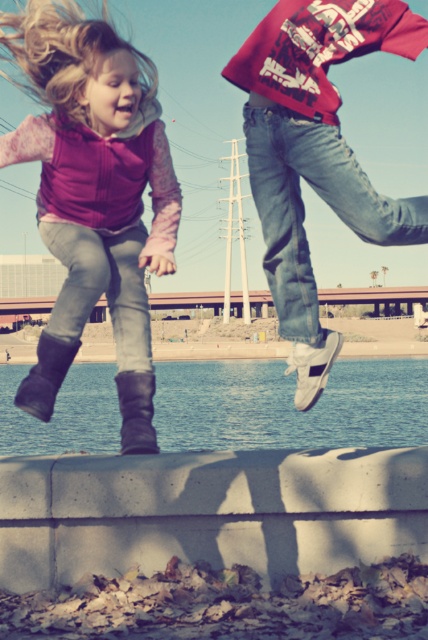
You are standing at the point labeled point (91, 67) and want to take a photo of the two children jumping off the concrete barrier. The camera you have can focus on subjects within 15 feet. Will the camera be able to capture the children clearly?

The point labeled point (91, 67) and the camera are 14.88 feet apart from each other, which is within the 15 feet focus range. Therefore, the camera will be able to capture the children clearly.

What is the purpose of the point at coordinates (94, 195) in the image?

The point at coordinates (94, 195) is located on the matte pink vest at upper left.

You are a photographer trying to capture both the matte pink vest at upper left and the blue water at lower center in the same frame. Based on their sizes, which object should you focus on first to ensure both are fully visible in the photo?

The matte pink vest at upper left has a smaller width compared to the blue water at lower center. To ensure both are fully visible, focus on the larger blue water at lower center first, then adjust the frame to include the smaller matte pink vest at upper left.